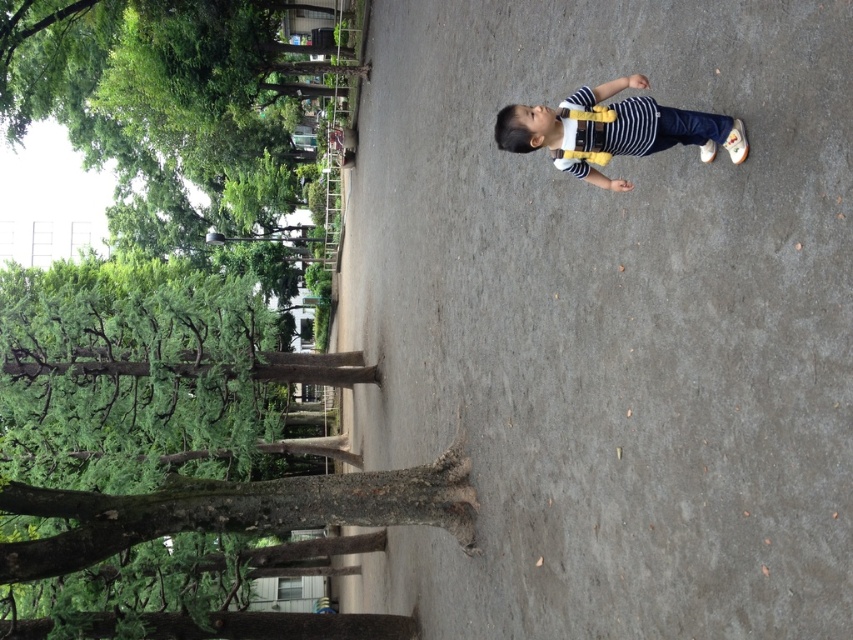
Question: Does brown rough tree trunk at center have a smaller size compared to white matte suspenders at center?

Choices:
 (A) no
 (B) yes

Answer: (A)

Question: Which point is farther to the camera?

Choices:
 (A) gray concrete at center
 (B) brown rough tree trunk at center
 (C) white matte suspenders at center

Answer: (B)

Question: Can you confirm if gray concrete at center is wider than brown rough tree trunk at center?

Choices:
 (A) no
 (B) yes

Answer: (A)

Question: Where is gray concrete at center located in relation to brown rough tree trunk at center in the image?

Choices:
 (A) right
 (B) left

Answer: (A)

Question: Among these points, which one is farthest from the camera?

Choices:
 (A) (740, 124)
 (B) (755, 481)
 (C) (6, 52)

Answer: (C)

Question: Estimate the real-world distances between objects in this image. Which object is closer to the white matte suspenders at center?

Choices:
 (A) gray concrete at center
 (B) brown rough tree trunk at center

Answer: (A)